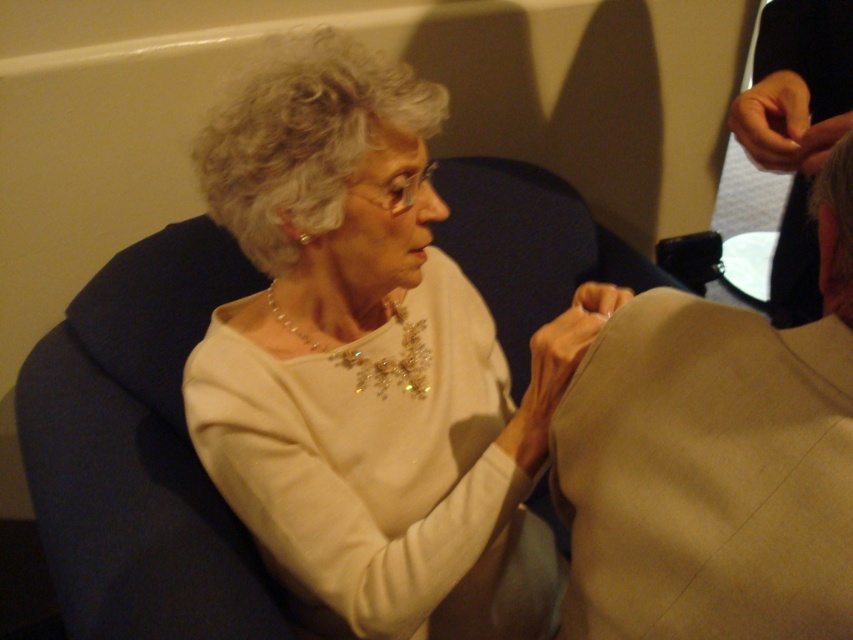
You are an event coordinator at the theater and need to ensure that the tan fabric sleeve at upper right and the matte beige fabric at upper right are visible to the camera. Which fabric should you adjust to be more forward to ensure both are visible?

The tan fabric sleeve at upper right is already closer to the viewer than the matte beige fabric at upper right. To ensure both are visible, you can move the matte beige fabric at upper right slightly forward so it is at the same level as the tan fabric sleeve at upper right.

You are an event photographer at a theater event. You need to focus your camera on two points in the image. The first point is point (534, 358) and the second is point (782, 84). Which point should you focus on first to ensure proper depth of field?

You should focus on point (534, 358) first because it is closer to the viewer than point (782, 84), ensuring the depth of field captures both points effectively.

You are a costume designer preparing for a play. You have two fabric samples in front of you. The first is a white satin blouse at center, and the second is a matte beige fabric at upper right. Which fabric sample has a greater width?

The white satin blouse at center has a greater width than the matte beige fabric at upper right.